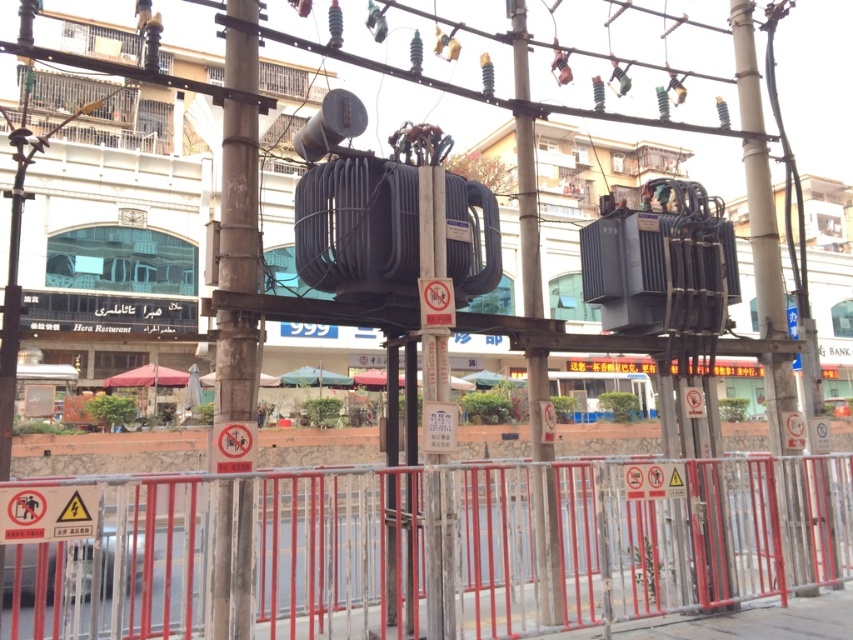
You are standing at the center of the image and want to locate the smooth beige pole at right. In which direction should you look to find it?

The smooth beige pole at right is located at the right side of the image, so you should look to your right to find it.

You are a city planner reviewing this urban scene. You need to place a new emergency access point equidistant from the rusty metal pole at center and the red metal barricade with several warning signs attached to it. Where should you position it?

The rusty metal pole at center is located at point (239,198). To place the emergency access point equidistant from both objects, calculate the midpoint between their coordinates. However, since the barricade coordinates aren t provided, precise placement requires additional data.

You are a delivery person trying to navigate through the area. You see the rusty metal pole at center and the smooth beige pole at right. Which pole should you avoid walking between if you want to stay clear of the power lines?

You should avoid walking between the rusty metal pole at center and the smooth beige pole at right because the power lines are suspended between them.